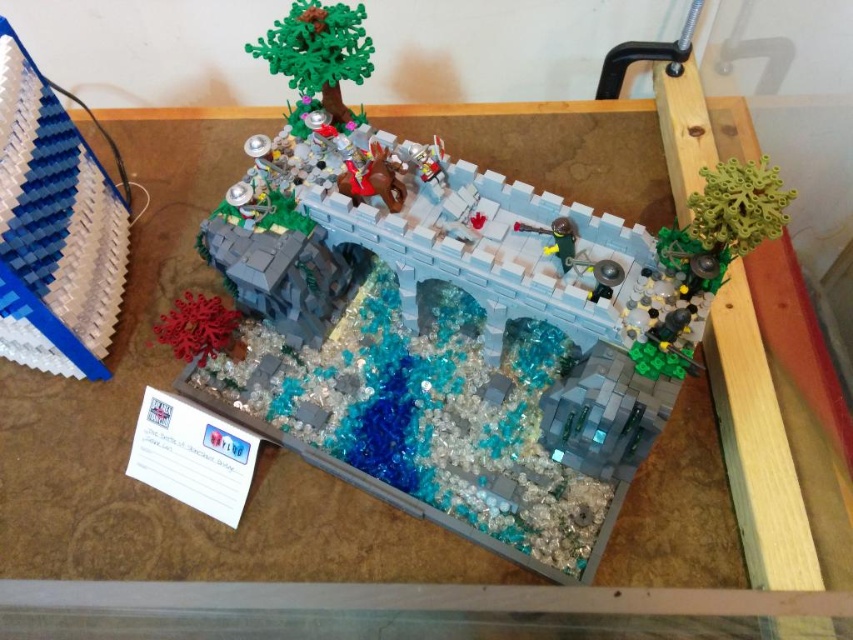
Question: Does blue matte foam at left appear on the left side of green matte tree at upper center?

Choices:
 (A) yes
 (B) no

Answer: (A)

Question: Does blue matte foam at left come in front of green matte tree at upper center?

Choices:
 (A) yes
 (B) no

Answer: (A)

Question: Does blue matte foam at left have a larger size compared to green matte tree at upper center?

Choices:
 (A) no
 (B) yes

Answer: (B)